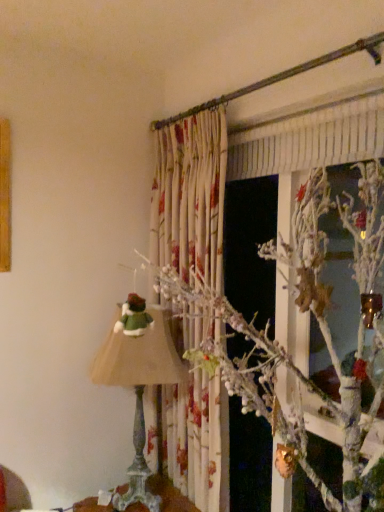
Question: Is white frosted branch at upper center completely or partially inside wooden table at lower center?

Choices:
 (A) no
 (B) yes

Answer: (A)

Question: Is wooden table at lower center touching white frosted branch at upper center?

Choices:
 (A) no
 (B) yes

Answer: (A)

Question: From the image's perspective, does wooden table at lower center appear lower than white frosted branch at upper center?

Choices:
 (A) no
 (B) yes

Answer: (B)

Question: Are wooden table at lower center and white frosted branch at upper center located far from each other?

Choices:
 (A) yes
 (B) no

Answer: (A)

Question: Considering the relative sizes of wooden table at lower center and white frosted branch at upper center in the image provided, is wooden table at lower center smaller than white frosted branch at upper center?

Choices:
 (A) no
 (B) yes

Answer: (A)

Question: Is wooden table at lower center wider than white frosted branch at upper center?

Choices:
 (A) yes
 (B) no

Answer: (A)

Question: Is white frosted branch at upper center positioned behind matte green fabric lampshade at left?

Choices:
 (A) no
 (B) yes

Answer: (A)

Question: Does white frosted branch at upper center have a smaller size compared to matte green fabric lampshade at left?

Choices:
 (A) yes
 (B) no

Answer: (A)

Question: Could you tell me if white frosted branch at upper center is facing matte green fabric lampshade at left?

Choices:
 (A) no
 (B) yes

Answer: (A)

Question: Is white frosted branch at upper center shorter than matte green fabric lampshade at left?

Choices:
 (A) no
 (B) yes

Answer: (B)

Question: Can you confirm if white frosted branch at upper center is wider than matte green fabric lampshade at left?

Choices:
 (A) no
 (B) yes

Answer: (A)

Question: Does white frosted branch at upper center have a lesser width compared to matte green fabric lampshade at left?

Choices:
 (A) yes
 (B) no

Answer: (A)

Question: Is matte green fabric lampshade at left not near white frosted branch at upper center?

Choices:
 (A) yes
 (B) no

Answer: (A)